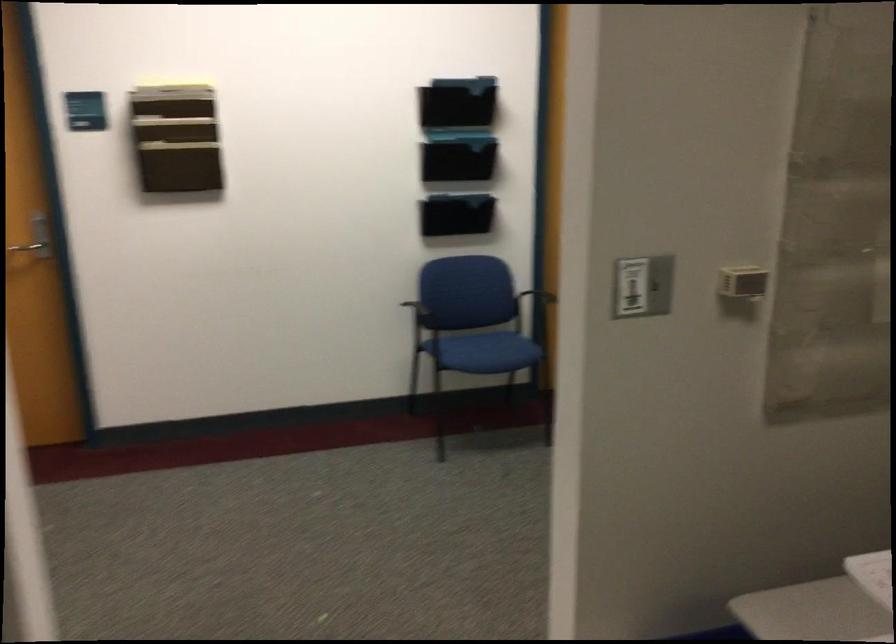
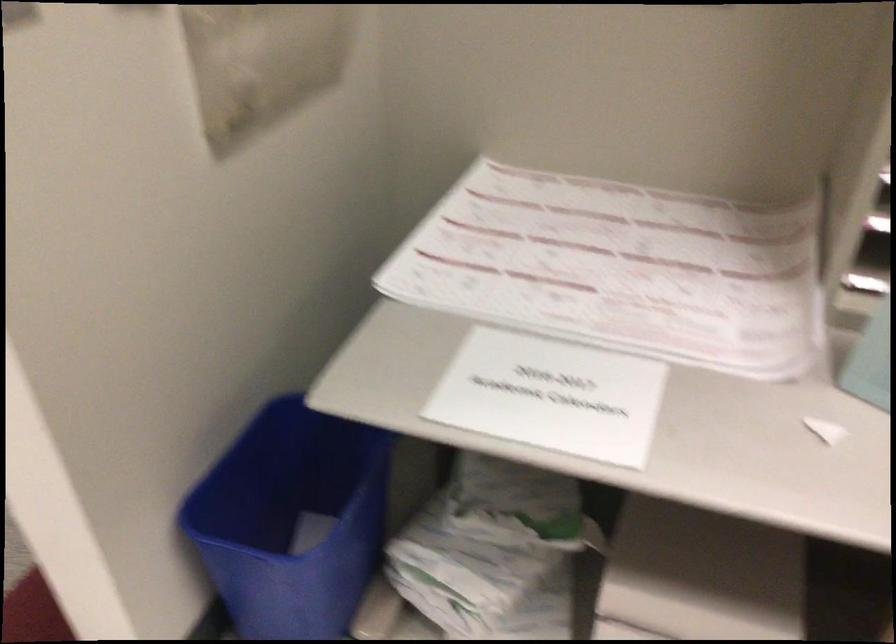
The images are taken continuously from a first-person perspective. In which direction is your viewpoint rotating?

The camera's rotation is toward right-down.